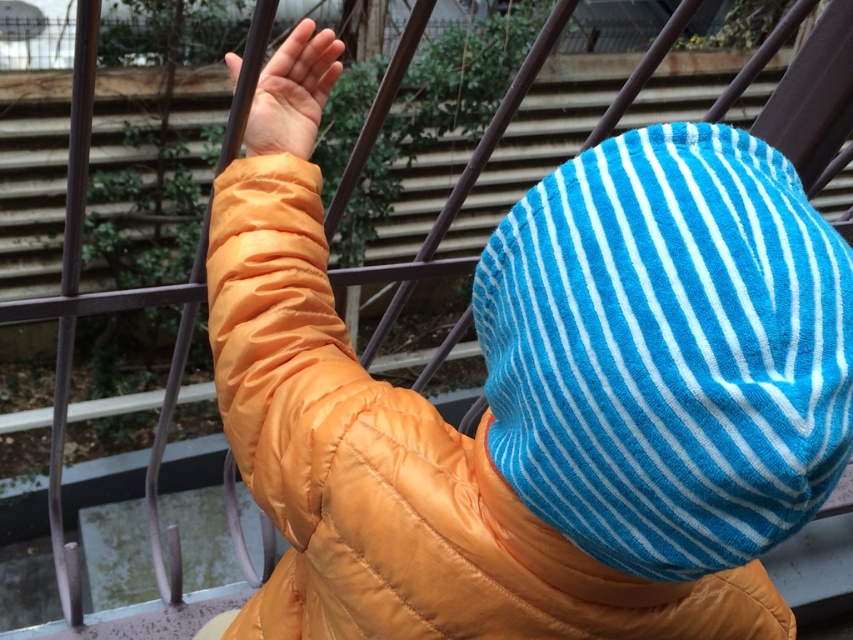
You are a photographer trying to capture a candid shot of the person on the balcony. You notice the blue striped hat at center and the orange matte hand at upper center. How far apart are these two features in the image?

The blue striped hat at center and orange matte hand at upper center are 15.65 inches apart.

You are a drone operator trying to deliver a small package to a person on a balcony. The delivery zone is marked by two points on the railing, point A at coordinates point [660,422] and point B at coordinates point [259,140]. To ensure safe delivery, you need to know which point is closer to the person. Which point should you aim for?

Point [660,422] is closer to the viewer than point [259,140], so you should aim for point [660,422] to ensure safe delivery.

You are a photographer trying to capture the blue striped towel at upper center and the orange matte hand at upper center in the same frame. Based on their positions, can you tell which object is closer to the camera?

The orange matte hand at upper center is closer to the camera because it is positioned above the blue striped towel at upper center, which is located below it.